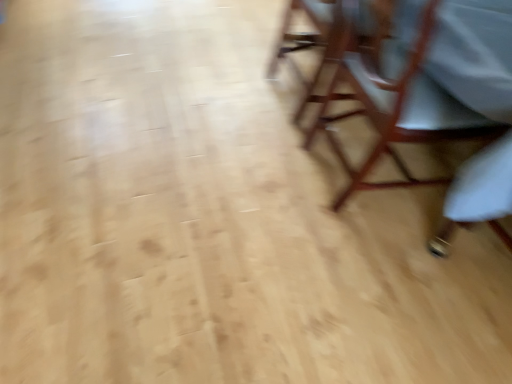
Question: Considering the positions of wooden chair at right, arranged as the 1th chair when viewed from the front, and wooden chair at upper right, which is the second chair from front to back, in the image, is wooden chair at right, arranged as the 1th chair when viewed from the front, taller or shorter than wooden chair at upper right, which is the second chair from front to back,?

Choices:
 (A) tall
 (B) short

Answer: (A)

Question: From the image's perspective, is wooden chair at right, the 2th chair positioned from the back, above or below wooden chair at upper right, the 1th chair positioned from the back?

Choices:
 (A) above
 (B) below

Answer: (B)

Question: Would you say wooden chair at right, arranged as the 1th chair when viewed from the front, is inside or outside wooden chair at upper right, the 1th chair positioned from the back?

Choices:
 (A) outside
 (B) inside

Answer: (A)

Question: From the image's perspective, is wooden chair at upper right, which is the second chair from front to back, located above or below wooden chair at right, the 2th chair positioned from the back?

Choices:
 (A) below
 (B) above

Answer: (B)

Question: Is wooden chair at upper right, the 1th chair positioned from the back, taller or shorter than wooden chair at right, arranged as the 1th chair when viewed from the front?

Choices:
 (A) short
 (B) tall

Answer: (A)

Question: Is point (340, 3) closer or farther from the camera than point (422, 34)?

Choices:
 (A) farther
 (B) closer

Answer: (A)

Question: Is wooden chair at upper right, which is the second chair from front to back, bigger or smaller than wooden chair at right, the 2th chair positioned from the back?

Choices:
 (A) big
 (B) small

Answer: (B)